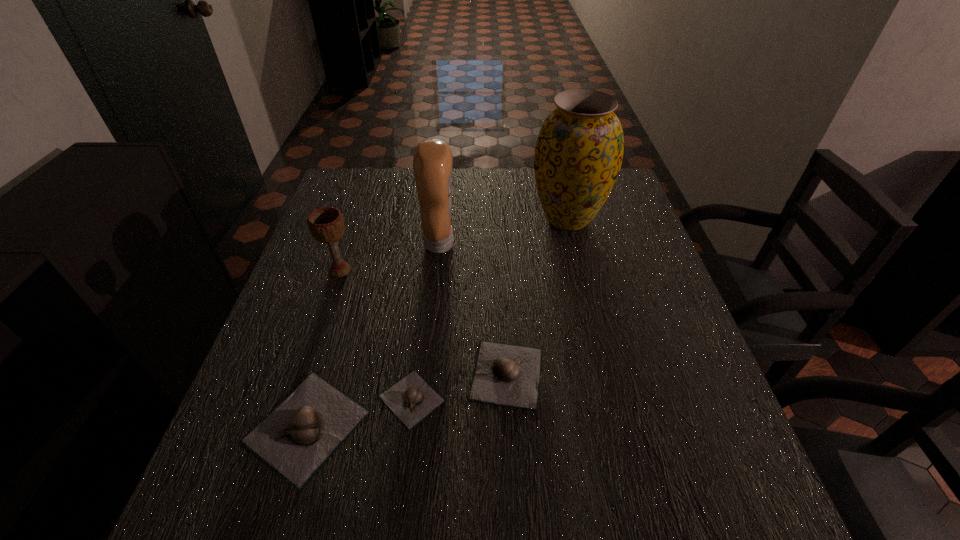
Locate an element on the screen. The image size is (960, 540). empty space between the leftmost garlic and the second tallest object is located at coordinates (373, 335).

Locate an element on the screen. This screenshot has width=960, height=540. unoccupied position between the vase and the leftmost garlic is located at coordinates (438, 322).

At what (x,y) coordinates should I click in order to perform the action: click on free spot between the chalice and the shortest garlic. Please return your answer as a coordinate pair (x, y). The width and height of the screenshot is (960, 540). Looking at the image, I should click on (376, 335).

Locate which object is the second closest to the vase. Please provide its 2D coordinates. Your answer should be formatted as a tuple, i.e. [(x, y)], where the tuple contains the x and y coordinates of a point satisfying the conditions above.

[(504, 374)]

Identify which object is the fifth closest to the condiment. Please provide its 2D coordinates. Your answer should be formatted as a tuple, i.e. [(x, y)], where the tuple contains the x and y coordinates of a point satisfying the conditions above.

[(298, 437)]

At what (x,y) coordinates should I click in order to perform the action: click on garlic that stands as the second closest to the chalice. Please return your answer as a coordinate pair (x, y). Looking at the image, I should click on (411, 399).

At what (x,y) coordinates should I click in order to perform the action: click on garlic that is the closest to the rightmost object. Please return your answer as a coordinate pair (x, y). The width and height of the screenshot is (960, 540). Looking at the image, I should click on (504, 374).

Find the location of a particular element. This screenshot has height=540, width=960. vacant area in the image that satisfies the following two spatial constraints: 1. on the back side of the second tallest garlic; 2. on the label of the second tallest object is located at coordinates (500, 243).